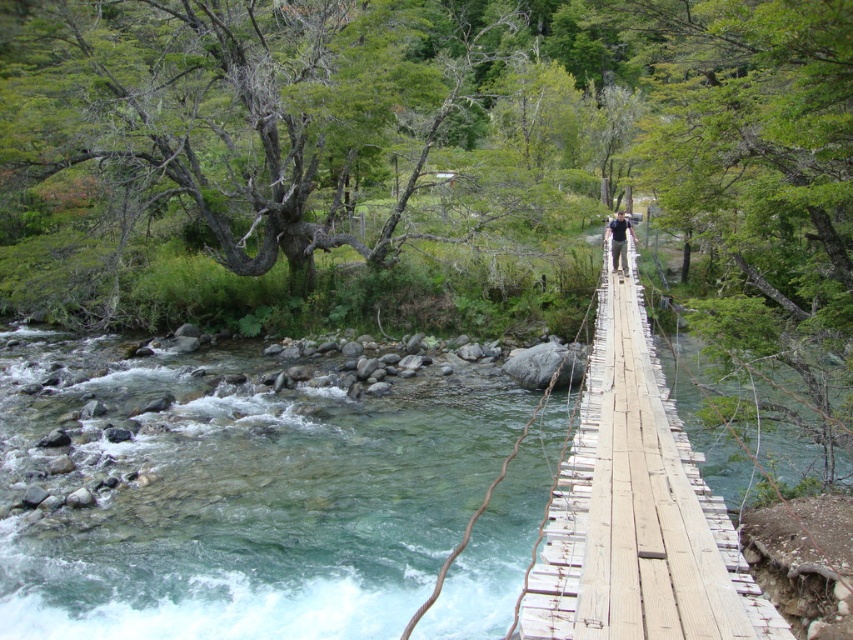
Question: Does light brown wooden bridge at center appear on the left side of dark blue shirt at center?

Choices:
 (A) yes
 (B) no

Answer: (A)

Question: Is light brown wooden bridge at center further to the viewer compared to dark blue shirt at center?

Choices:
 (A) no
 (B) yes

Answer: (A)

Question: Among these points, which one is nearest to the camera?

Choices:
 (A) (630, 435)
 (B) (619, 237)

Answer: (A)

Question: Is light brown wooden bridge at center positioned before dark blue shirt at center?

Choices:
 (A) yes
 (B) no

Answer: (A)

Question: Which of the following is the closest to the observer?

Choices:
 (A) dark blue shirt at center
 (B) light brown wooden bridge at center

Answer: (B)